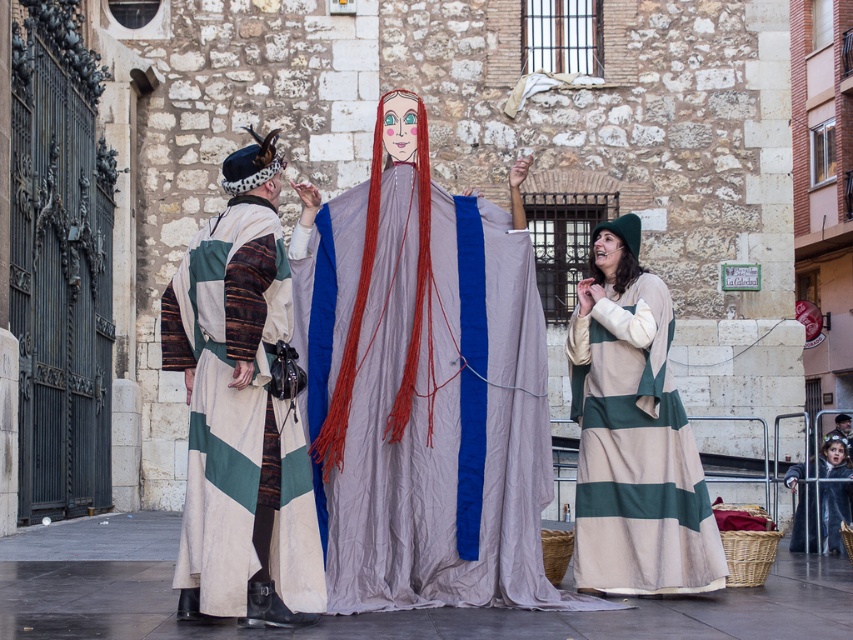
You are a photographer positioned at the center of the street. You want to capture a photo that includes both the green striped fabric dress at lower right and the velvet black robe at lower right. Which of the two objects is positioned closer to your camera?

The green striped fabric dress at lower right is closer to the viewer than the velvet black robe at lower right, so the green striped fabric dress at lower right will be closer to your camera.

What is the exact coordinate of the matte gray fabric at center?

The matte gray fabric at center is located at point (444,420).